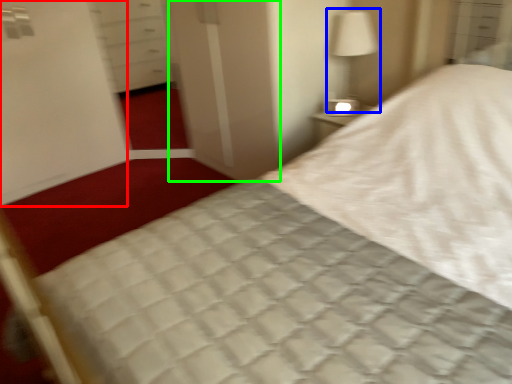
Question: Which is nearer to the screen door (highlighted by a red box)? bedside lamp (highlighted by a blue box) or screen door (highlighted by a green box).

Choices:
 (A) bedside lamp
 (B) screen door

Answer: (B)